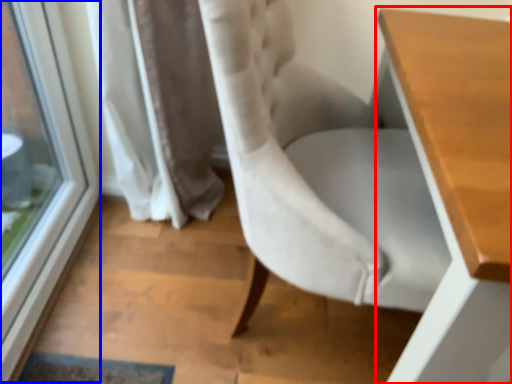
Question: Which object appears farthest to the camera in this image, table (highlighted by a red box) or window (highlighted by a blue box)?

Choices:
 (A) table
 (B) window

Answer: (B)